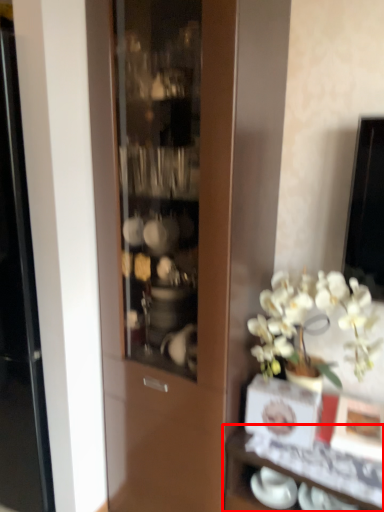
Question: From the image, what is the correct spatial relationship of shelf (annotated by the red box) in relation to tableware?

Choices:
 (A) left
 (B) right

Answer: (B)